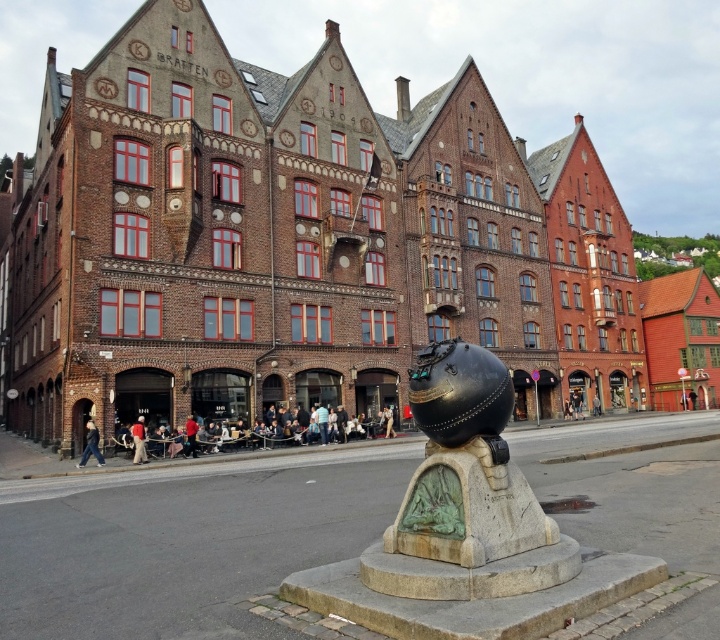
From the picture: You are standing at the center of the image and want to find the dark blue jeans at lower left. Based on their position, in which direction should you move to locate them?

The dark blue jeans at lower left is located at point (90, 445), which means you should move towards the lower left direction from the center to find them.

You are standing at the point marked as point (467, 493). What object is located exactly at your current position?

The shiny black sphere at center is located exactly at point (467, 493).